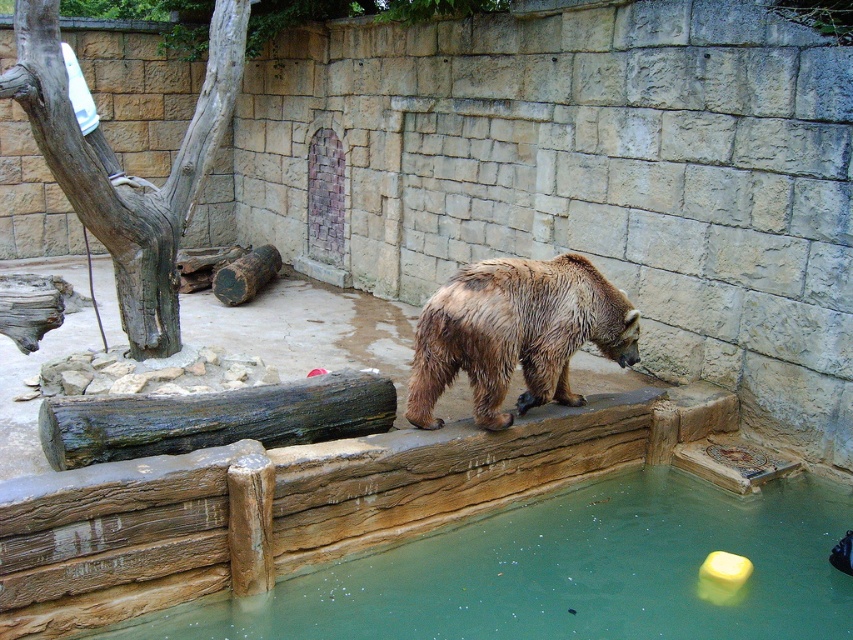
You are a zookeeper who needs to ensure the bear has enough space to move around on the wooden platform. Given that the wet fur bear at center is thinner than the weathered wood log at center, can the bear comfortably turn around on the platform?

The wet fur bear at center is thinner than the weathered wood log at center, so the bear should have enough space to comfortably turn around on the platform since it is narrower than the log.

Looking at this image, you are a zookeeper checking the enclosure layout. The bear needs to access the water for cooling. Is the greenish water at lower center positioned in a way that the wet fur bear at center can reach it easily?

The greenish water at lower center is located below the wet fur bear at center, so the bear can easily step down to the water for cooling.